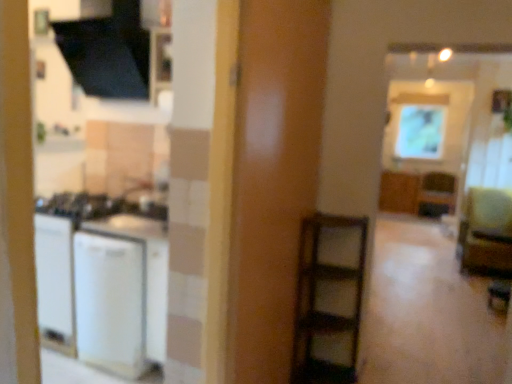
This screenshot has height=384, width=512. Describe the element at coordinates (273, 177) in the screenshot. I see `matte brown screen door at center` at that location.

You are a GUI agent. You are given a task and a screenshot of the screen. Output one action in this format:
    pyautogui.click(x=<x>, y=<y>)
    Task: Click on the matte brown screen door at center
    This screenshot has width=512, height=384.
    Given the screenshot: What is the action you would take?
    pyautogui.click(x=273, y=177)

Image resolution: width=512 pixels, height=384 pixels. Identify the location of white matte refrigerator at left. (101, 283).

The height and width of the screenshot is (384, 512). Describe the element at coordinates (420, 132) in the screenshot. I see `matte glass window screen at upper right` at that location.

At what (x,y) coordinates should I click in order to perform the action: click on wooden cabinet at upper right, the first cabinetry from the left. Please return your answer as a coordinate pair (x, y). Image resolution: width=512 pixels, height=384 pixels. Looking at the image, I should click on (399, 192).

This screenshot has height=384, width=512. What do you see at coordinates (486, 230) in the screenshot?
I see `green fabric armchair at right` at bounding box center [486, 230].

Identify the location of matte brown screen door at center. The image size is (512, 384). (273, 177).

Is matte glass window screen at upper right in front of or behind wooden cabinet at upper right, the first cabinetry from the left, in the image?

Clearly, matte glass window screen at upper right is behind wooden cabinet at upper right, the first cabinetry from the left.

Considering the positions of point (437, 148) and point (390, 190), is point (437, 148) closer or farther from the camera than point (390, 190)?

Point (437, 148) appears to be closer to the viewer than point (390, 190).

Looking at this image, between matte glass window screen at upper right and wooden cabinet at upper right, the first cabinetry from the left, which one has larger size?

wooden cabinet at upper right, the first cabinetry from the left.

Is matte glass window screen at upper right to the left or to the right of wooden cabinet at upper right, the first cabinetry from the left, in the image?

In the image, matte glass window screen at upper right appears on the right side of wooden cabinet at upper right, the first cabinetry from the left.

In terms of width, does wooden cabinet at upper right, the second cabinetry in the right-to-left sequence, look wider or thinner when compared to matte glass window screen at upper right?

In the image, wooden cabinet at upper right, the second cabinetry in the right-to-left sequence, appears to be wider than matte glass window screen at upper right.

Considering the sizes of objects wooden cabinet at upper right, the first cabinetry from the left, and matte glass window screen at upper right in the image provided, who is shorter, wooden cabinet at upper right, the first cabinetry from the left, or matte glass window screen at upper right?

With less height is wooden cabinet at upper right, the first cabinetry from the left.

Between point (415, 175) and point (423, 107), which one is positioned in front?

Positioned in front is point (415, 175).

Considering the relative positions of wooden cabinet at upper right, the second cabinetry in the right-to-left sequence, and matte glass window screen at upper right in the image provided, is wooden cabinet at upper right, the second cabinetry in the right-to-left sequence, in front of matte glass window screen at upper right?

Yes, wooden cabinet at upper right, the second cabinetry in the right-to-left sequence, is closer to the viewer.

Could you measure the distance between matte glass window screen at upper right and wooden cabinet at center-right, the first cabinetry positioned from the right?

28.10 inches.

From a real-world perspective, is matte glass window screen at upper right positioned above or below wooden cabinet at center-right, which ranks as the second cabinetry in left-to-right order?

From a real-world perspective, matte glass window screen at upper right is physically above wooden cabinet at center-right, which ranks as the second cabinetry in left-to-right order.

Between matte glass window screen at upper right and wooden cabinet at center-right, which ranks as the second cabinetry in left-to-right order, which one has larger width?

wooden cabinet at center-right, which ranks as the second cabinetry in left-to-right order.

What's the angular difference between matte glass window screen at upper right and wooden cabinet at center-right, which ranks as the second cabinetry in left-to-right order,'s facing directions?

4.03 degrees.

From a real-world perspective, does wooden cabinet at center-right, which ranks as the second cabinetry in left-to-right order, sit lower than white matte refrigerator at left?

Yes, from a real-world perspective, wooden cabinet at center-right, which ranks as the second cabinetry in left-to-right order, is beneath white matte refrigerator at left.

From the image's perspective, which is below, wooden cabinet at center-right, which ranks as the second cabinetry in left-to-right order, or white matte refrigerator at left?

white matte refrigerator at left appears lower in the image.

In terms of height, does wooden cabinet at center-right, the first cabinetry positioned from the right, look taller or shorter compared to white matte refrigerator at left?

Considering their sizes, wooden cabinet at center-right, the first cabinetry positioned from the right, has less height than white matte refrigerator at left.

Is wooden cabinet at center-right, the first cabinetry positioned from the right, turned away from white matte refrigerator at left?

That's not correct — wooden cabinet at center-right, the first cabinetry positioned from the right, is not looking away from white matte refrigerator at left.

Which of these two, white matte refrigerator at left or wooden cabinet at upper right, the second cabinetry in the right-to-left sequence, stands taller?

white matte refrigerator at left is taller.

Between white matte refrigerator at left and wooden cabinet at upper right, the first cabinetry from the left, which one appears on the right side from the viewer's perspective?

wooden cabinet at upper right, the first cabinetry from the left, is more to the right.

The height and width of the screenshot is (384, 512). I want to click on cabinetry that is the 2nd object located above the white matte refrigerator at left (from the image's perspective), so click(399, 192).

Considering the sizes of white matte refrigerator at left and wooden cabinet at upper right, the first cabinetry from the left, in the image, is white matte refrigerator at left wider or thinner than wooden cabinet at upper right, the first cabinetry from the left,?

white matte refrigerator at left is wider than wooden cabinet at upper right, the first cabinetry from the left.

Consider the image. Who is taller, green fabric armchair at right or white matte refrigerator at left?

With more height is green fabric armchair at right.

What's the angular difference between green fabric armchair at right and white matte refrigerator at left's facing directions?

1.87 degrees separate the facing orientations of green fabric armchair at right and white matte refrigerator at left.

Is white matte refrigerator at left at the back of green fabric armchair at right?

No, green fabric armchair at right's orientation is not away from white matte refrigerator at left.

Does green fabric armchair at right come in front of white matte refrigerator at left?

No, green fabric armchair at right is further to the viewer.

Consider the image. Which of these two, matte brown screen door at center or green fabric armchair at right, is bigger?

Bigger between the two is green fabric armchair at right.

From a real-world perspective, between matte brown screen door at center and green fabric armchair at right, who is vertically higher?

In real-world perspective, matte brown screen door at center is above.

Does point (289, 117) lie in front of point (474, 192)?

That is True.

What are the coordinates of `cabinetry that appears on the left of matte glass window screen at upper right` in the screenshot? It's located at (399, 192).

The width and height of the screenshot is (512, 384). Identify the location of the 1st cabinetry in front of the matte glass window screen at upper right, starting your count from the anchor. (399, 192).

Looking at the image, which one is located closer to white matte refrigerator at left, matte glass window screen at upper right or wooden cabinet at upper right, the second cabinetry in the right-to-left sequence?

wooden cabinet at upper right, the second cabinetry in the right-to-left sequence, is closer to white matte refrigerator at left.

When comparing their distances from matte brown screen door at center, does matte glass window screen at upper right or white matte refrigerator at left seem further?

The object further to matte brown screen door at center is matte glass window screen at upper right.

Consider the image. Considering their positions, is matte glass window screen at upper right positioned closer to wooden cabinet at center-right, which ranks as the second cabinetry in left-to-right order, than white matte refrigerator at left?

Among the two, matte glass window screen at upper right is located nearer to wooden cabinet at center-right, which ranks as the second cabinetry in left-to-right order.

When comparing their distances from wooden cabinet at upper right, the first cabinetry from the left, does wooden cabinet at center-right, the first cabinetry positioned from the right, or matte glass window screen at upper right seem closer?

wooden cabinet at center-right, the first cabinetry positioned from the right, lies closer to wooden cabinet at upper right, the first cabinetry from the left, than the other object.

When comparing their distances from wooden cabinet at upper right, the second cabinetry in the right-to-left sequence, does matte brown screen door at center or matte glass window screen at upper right seem further?

The object further to wooden cabinet at upper right, the second cabinetry in the right-to-left sequence, is matte brown screen door at center.

When comparing their distances from matte glass window screen at upper right, does white matte refrigerator at left or green fabric armchair at right seem further?

white matte refrigerator at left is positioned further to the anchor matte glass window screen at upper right.

From the picture: Considering their positions, is green fabric armchair at right positioned further to wooden cabinet at center-right, which ranks as the second cabinetry in left-to-right order, than white matte refrigerator at left?

white matte refrigerator at left lies further to wooden cabinet at center-right, which ranks as the second cabinetry in left-to-right order, than the other object.

Considering their positions, is wooden cabinet at center-right, the first cabinetry positioned from the right, positioned further to green fabric armchair at right than white matte refrigerator at left?

Based on the image, white matte refrigerator at left appears to be further to green fabric armchair at right.

Locate an element on the screen. The image size is (512, 384). appliance located between matte brown screen door at center and matte glass window screen at upper right in the depth direction is located at coordinates (101, 283).

Identify the location of armchair between white matte refrigerator at left and matte glass window screen at upper right in the front-back direction. Image resolution: width=512 pixels, height=384 pixels. (486, 230).

Find the location of a particular element. This screenshot has width=512, height=384. cabinetry between matte glass window screen at upper right and wooden cabinet at center-right, the first cabinetry positioned from the right, from top to bottom is located at coordinates (399, 192).

Identify the location of cabinetry between green fabric armchair at right and wooden cabinet at upper right, the first cabinetry from the left, in the front-back direction. (416, 191).